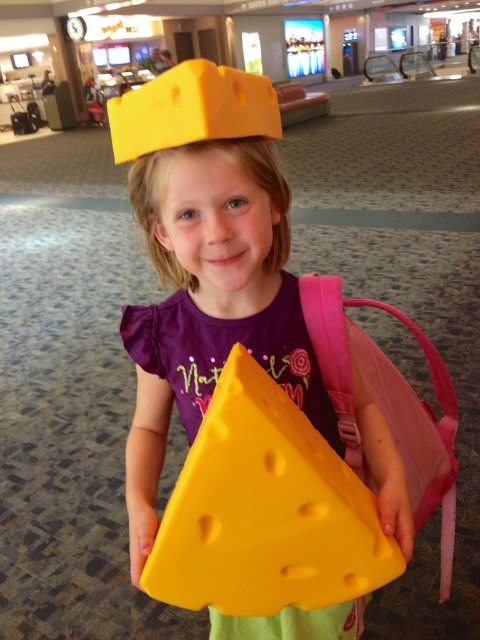
Question: Which object is the closest to the yellow rubbery cheese at center?

Choices:
 (A) matte yellow cheese at center
 (B) yellow matte cheese at center

Answer: (B)

Question: Estimate the real-world distances between objects in this image. Which object is farther from the yellow matte cheese at center?

Choices:
 (A) matte yellow cheese at center
 (B) yellow rubbery cheese at center

Answer: (A)

Question: Does yellow matte cheese at center appear on the right side of matte yellow cheese at center?

Choices:
 (A) yes
 (B) no

Answer: (B)

Question: Which of the following is the farthest from the observer?

Choices:
 (A) yellow rubbery cheese at center
 (B) matte yellow cheese at center
 (C) yellow matte cheese at center

Answer: (B)

Question: Can you confirm if yellow matte cheese at center is positioned to the right of yellow rubbery cheese at center?

Choices:
 (A) yes
 (B) no

Answer: (B)

Question: In this image, where is yellow rubbery cheese at center located relative to matte yellow cheese at center?

Choices:
 (A) above
 (B) below

Answer: (B)